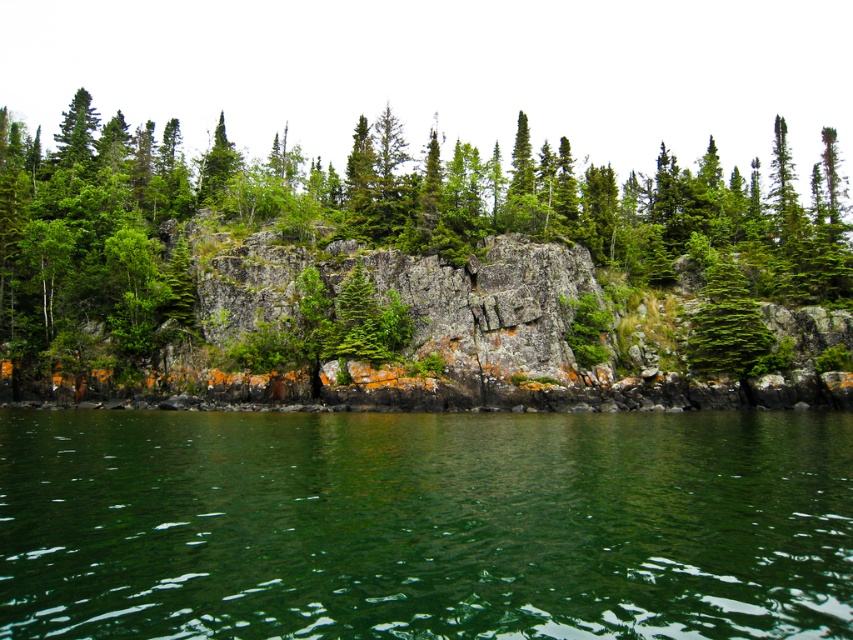
Does green liquid at lower center have a greater width compared to green matte tree at lower left?

Incorrect, green liquid at lower center's width does not surpass green matte tree at lower left's.

Is point (595, 609) positioned in front of point (49, 337)?

Yes, point (595, 609) is closer to viewer.

Identify the location of green liquid at lower center. (424, 524).